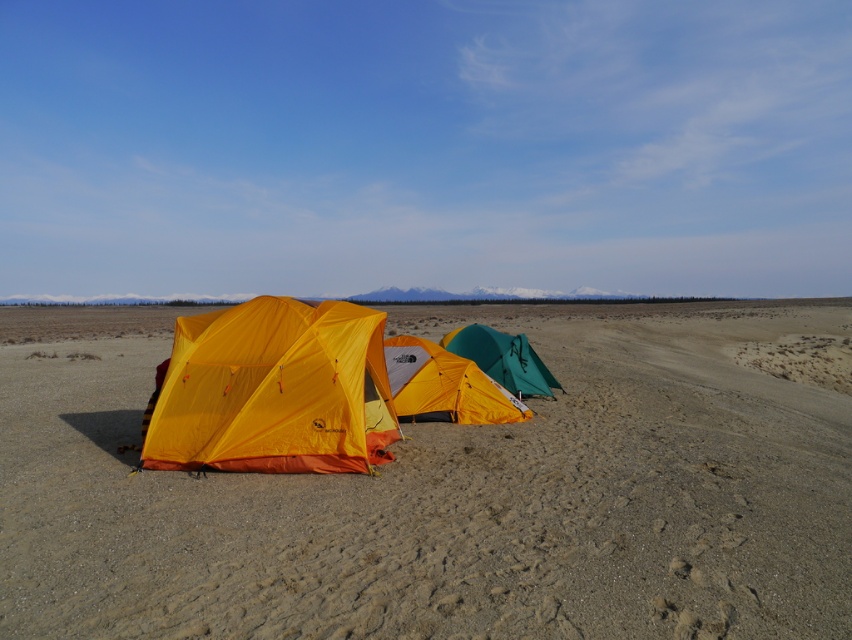
Question: Can you confirm if matte yellow tent at center is smaller than green matte tent at center?

Choices:
 (A) no
 (B) yes

Answer: (A)

Question: Which point is farther from the camera taking this photo?

Choices:
 (A) (488, 404)
 (B) (491, 541)
 (C) (383, 397)

Answer: (A)

Question: Which point is farther from the camera taking this photo?

Choices:
 (A) (228, 392)
 (B) (501, 388)

Answer: (B)

Question: Does orange tarpaulin tent at left come behind matte yellow tent at center?

Choices:
 (A) no
 (B) yes

Answer: (A)

Question: Is dirtgrainyfield at center behind matte yellow tent at center?

Choices:
 (A) no
 (B) yes

Answer: (A)

Question: Which object is closer to the camera taking this photo?

Choices:
 (A) orange tarpaulin tent at left
 (B) matte yellow tent at center
 (C) dirtgrainyfield at center
 (D) green matte tent at center

Answer: (C)